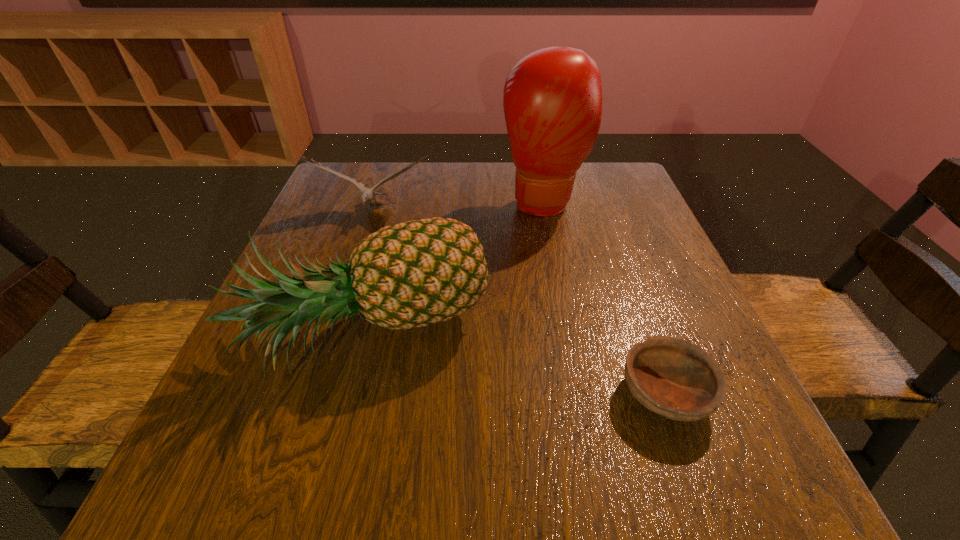
You are a GUI agent. You are given a task and a screenshot of the screen. Output one action in this format:
    pyautogui.click(x=<x>, y=<y>)
    Task: Click on the pineapple situated at the left edge
    
    Given the screenshot: What is the action you would take?
    pyautogui.click(x=413, y=274)

At what (x,y) coordinates should I click in order to perform the action: click on gull at the left edge. Please return your answer as a coordinate pair (x, y). The height and width of the screenshot is (540, 960). Looking at the image, I should click on (367, 194).

Find the location of `boxing glove situated at the right edge`. boxing glove situated at the right edge is located at coordinates (552, 100).

Where is `bowl situated at the right edge`? This screenshot has height=540, width=960. bowl situated at the right edge is located at coordinates tap(674, 378).

At what (x,y) coordinates should I click in order to perform the action: click on object situated at the far left corner. Please return your answer as a coordinate pair (x, y). The height and width of the screenshot is (540, 960). Looking at the image, I should click on (367, 194).

This screenshot has width=960, height=540. Identify the location of object present at the far right corner. (552, 100).

The width and height of the screenshot is (960, 540). I want to click on free spot at the far edge of the desktop, so click(476, 205).

Image resolution: width=960 pixels, height=540 pixels. What are the coordinates of `vacant space at the left edge` in the screenshot? It's located at [310, 216].

The width and height of the screenshot is (960, 540). Find the location of `vacant region at the right edge of the desktop`. vacant region at the right edge of the desktop is located at coordinates (596, 269).

The image size is (960, 540). In the image, there is a desktop. In order to click on vacant space at the far left corner in this screenshot , I will do pyautogui.click(x=379, y=193).